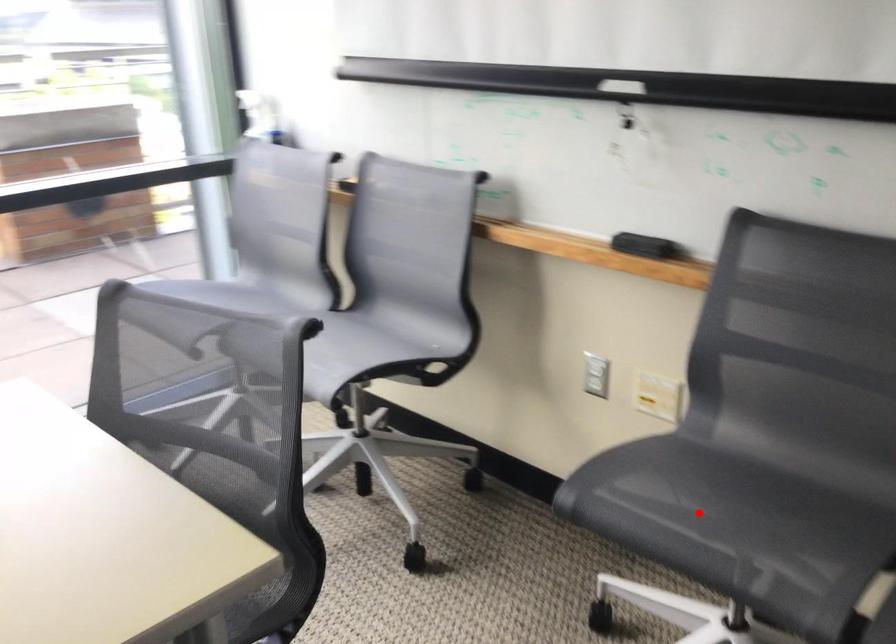
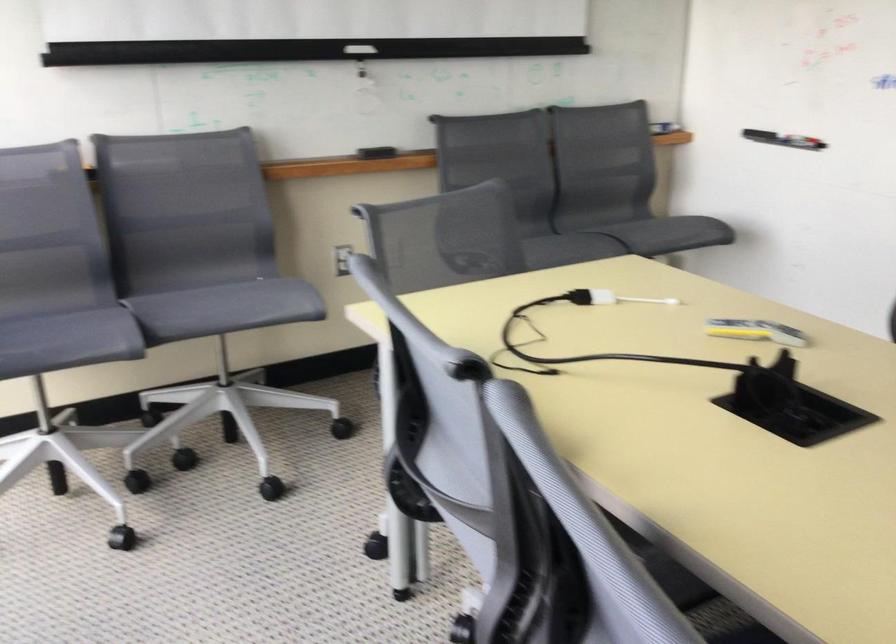
Where in the second image is the point corresponding to the highlighted location from the first image?

(538, 247)